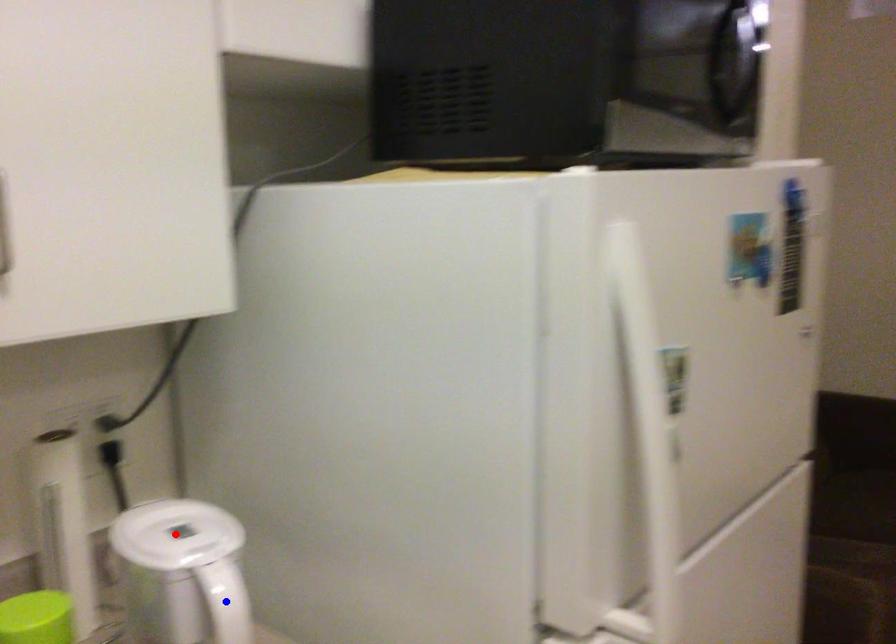
Question: Which of the two points in the image is closer to the camera?

Choices:
 (A) Blue point is closer.
 (B) Red point is closer.

Answer: (A)